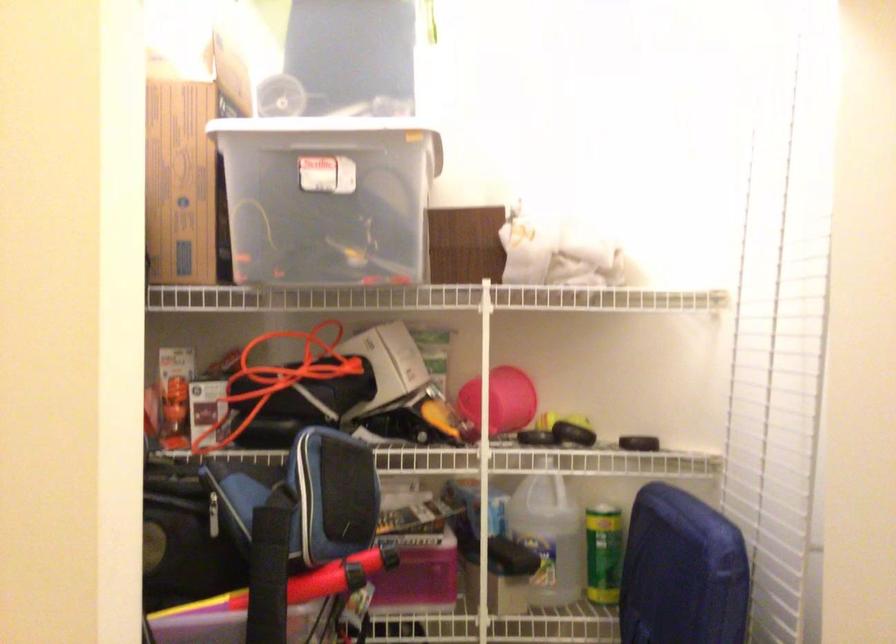
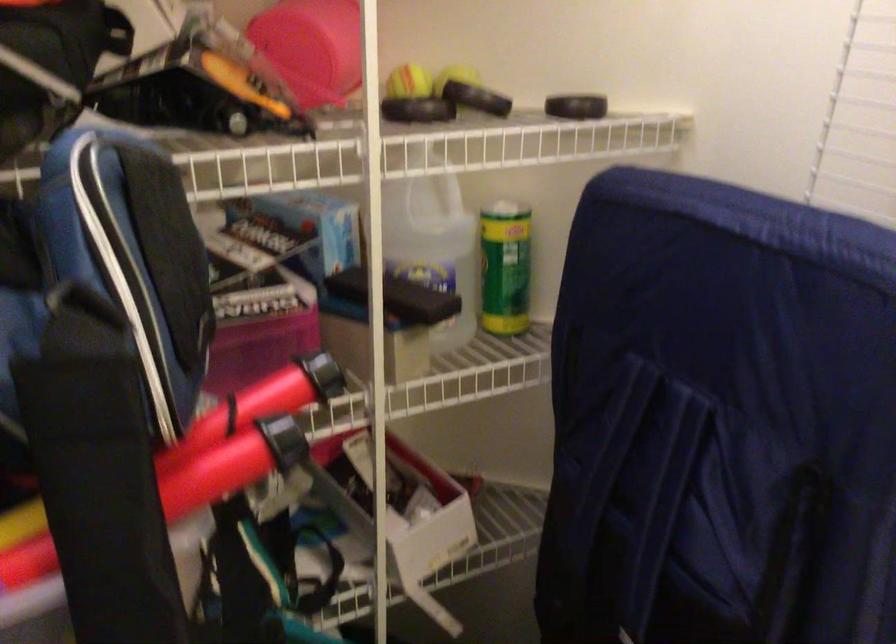
In the second image, find the point that corresponds to pixel 538 526 in the first image.

(433, 243)